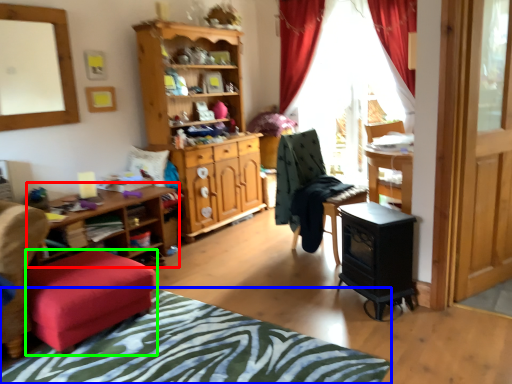
Question: Estimate the real-world distances between objects in this image. Which object is farther from table (highlighted by a red box), bedcover (highlighted by a blue box) or stool (highlighted by a green box)?

Choices:
 (A) bedcover
 (B) stool

Answer: (A)